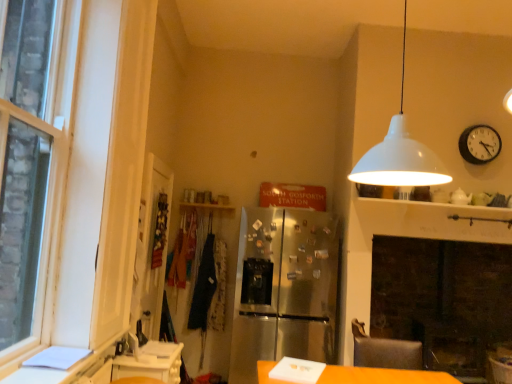
Question: Is black matte clock at upper right inside or outside of stainless steel refrigerator at center?

Choices:
 (A) outside
 (B) inside

Answer: (A)

Question: In terms of size, does black matte clock at upper right appear bigger or smaller than stainless steel refrigerator at center?

Choices:
 (A) small
 (B) big

Answer: (A)

Question: Which object is positioned farthest from the black matte clock at upper right?

Choices:
 (A) white glossy counter at lower left
 (B) stainless steel refrigerator at center
 (C) dark blue fabric at center
 (D) clear glass door at left
 (E) white matte lampshade at upper right

Answer: (A)

Question: Estimate the real-world distances between objects in this image. Which object is closer to the white glossy counter at lower left?

Choices:
 (A) white matte lampshade at upper right
 (B) black matte clock at upper right
 (C) clear glass door at left
 (D) stainless steel refrigerator at center
 (E) dark blue fabric at center

Answer: (C)